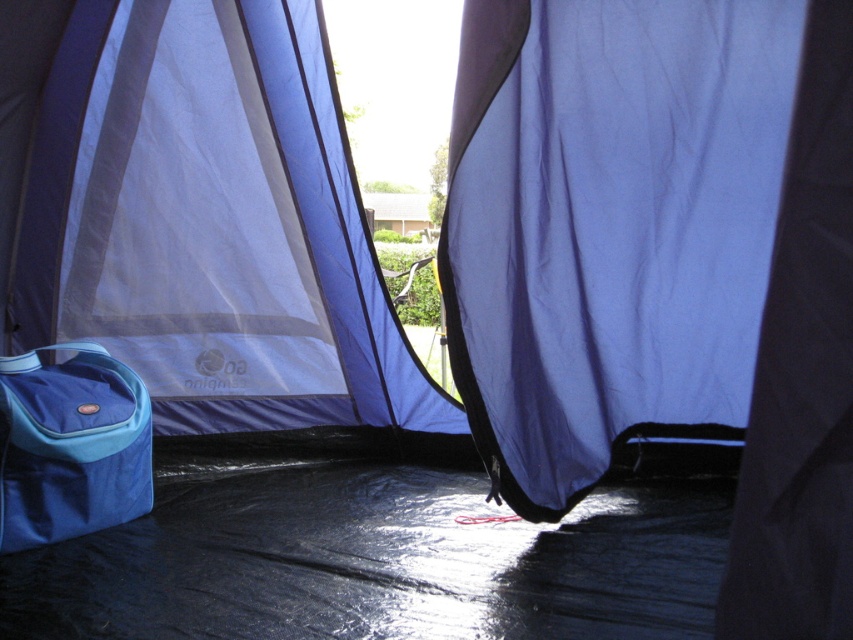
Is blue fabric canopy at center thinner than blue fabric curtain at center?

Incorrect, blue fabric canopy at center's width is not less than blue fabric curtain at center's.

Is blue fabric canopy at center to the left of blue fabric curtain at center from the viewer's perspective?

Indeed, blue fabric canopy at center is positioned on the left side of blue fabric curtain at center.

Where is `blue fabric canopy at center`? The image size is (853, 640). blue fabric canopy at center is located at coordinates (201, 218).

What do you see at coordinates (201, 218) in the screenshot?
I see `blue fabric canopy at center` at bounding box center [201, 218].

Who is more forward, (225, 401) or (38, 500)?

Point (38, 500)

Is point (196, 150) more distant than point (90, 435)?

Yes, point (196, 150) is behind point (90, 435).

Image resolution: width=853 pixels, height=640 pixels. In order to click on blue fabric canopy at center in this screenshot , I will do `click(201, 218)`.

Can you confirm if blue fabric curtain at center is thinner than blue fabric bag at lower left?

No, blue fabric curtain at center is not thinner than blue fabric bag at lower left.

Identify the location of blue fabric curtain at center. (608, 225).

Is point (519, 138) positioned after point (71, 424)?

No, it is in front of (71, 424).

In order to click on blue fabric curtain at center in this screenshot , I will do `click(608, 225)`.